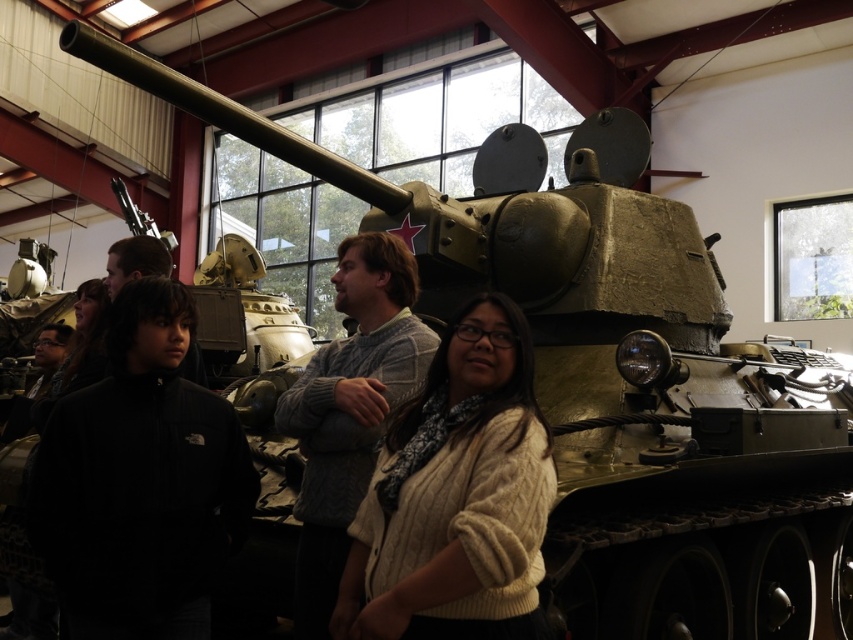
Question: Which of these objects is positioned farthest from the dark brown sweater at left?

Choices:
 (A) knitted sweater at center
 (B) white knit sweater at center

Answer: (B)

Question: Estimate the real-world distances between objects in this image. Which object is closer to the dark brown sweater at left?

Choices:
 (A) white knit sweater at center
 (B) dark gray sweater at center
 (C) knitted sweater at center

Answer: (B)

Question: Does dark gray sweater at center lie in front of white knit sweater at center?

Choices:
 (A) yes
 (B) no

Answer: (B)

Question: Is dark gray sweater at center smaller than white knit sweater at center?

Choices:
 (A) yes
 (B) no

Answer: (A)

Question: Which point is farther to the camera?

Choices:
 (A) (372, 273)
 (B) (141, 401)
 (C) (415, 602)

Answer: (A)

Question: Does dark gray sweater at center appear over dark brown sweater at left?

Choices:
 (A) yes
 (B) no

Answer: (B)